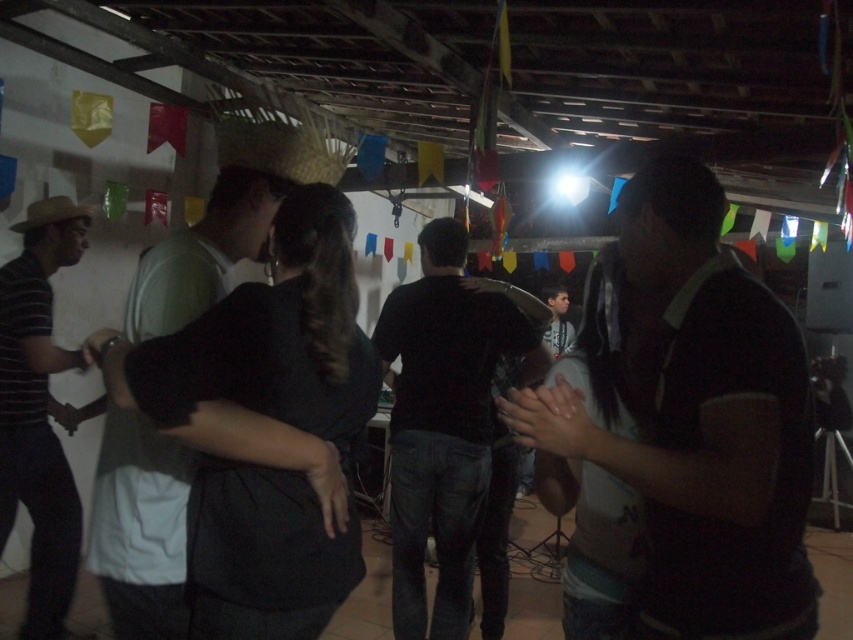
Question: Does dark green shirt at center appear over straw hat at center?

Choices:
 (A) no
 (B) yes

Answer: (A)

Question: Estimate the real-world distances between objects in this image. Which object is closer to the dark brown shirt at center?

Choices:
 (A) straw hat at center
 (B) dark green shirt at center
 (C) striped cotton shirt at left

Answer: (B)

Question: Is dark green shirt at center in front of striped cotton shirt at left?

Choices:
 (A) yes
 (B) no

Answer: (A)

Question: Which of these objects is positioned farthest from the dark green shirt at center?

Choices:
 (A) dark brown shirt at center
 (B) straw hat at center

Answer: (B)

Question: Which point appears closest to the camera in this image?

Choices:
 (A) (717, 584)
 (B) (401, 461)
 (C) (3, 346)
 (D) (184, 300)

Answer: (A)

Question: Considering the relative positions of dark brown shirt at center and black matte shirt at center in the image provided, where is dark brown shirt at center located with respect to black matte shirt at center?

Choices:
 (A) left
 (B) right

Answer: (B)